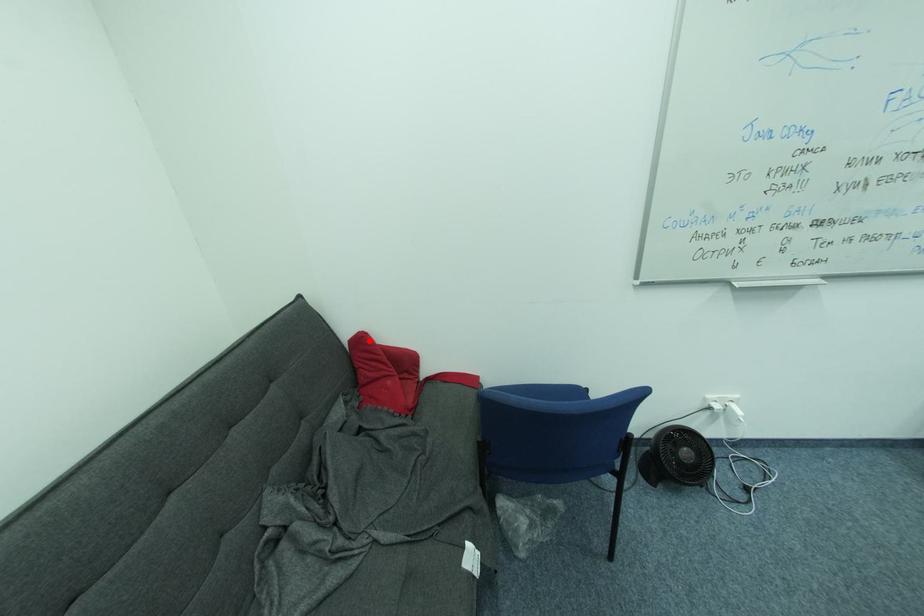
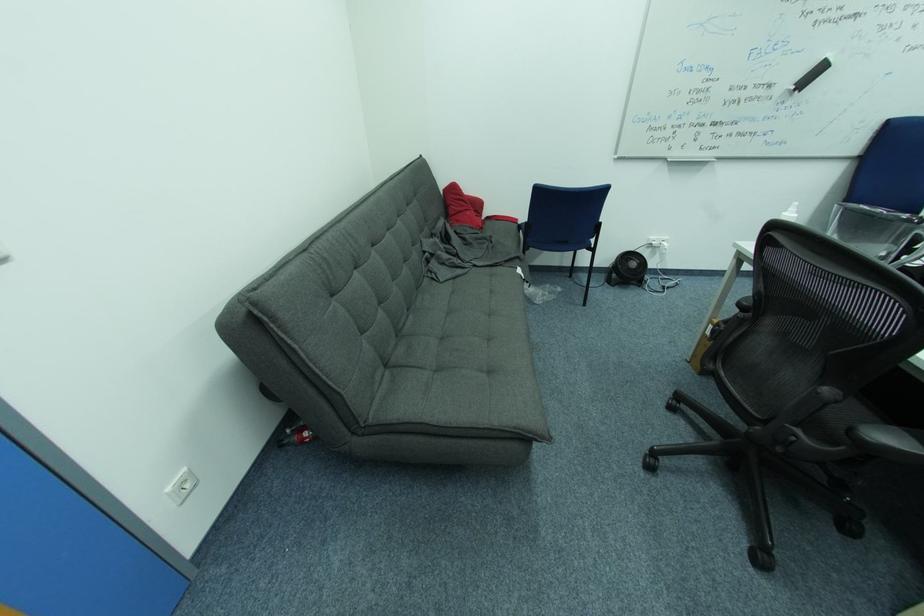
Where in the second image is the point corresponding to the highlighted location from the first image?

(459, 188)